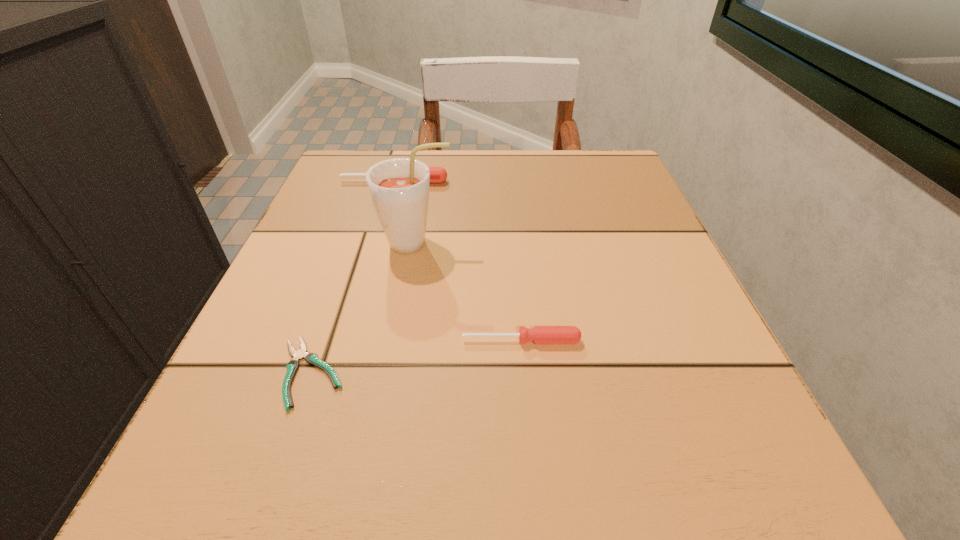
In order to click on free space between the shortest object and the second farthest object in this screenshot , I will do `click(364, 308)`.

The height and width of the screenshot is (540, 960). I want to click on free space between the shortest object and the tallest object, so click(364, 308).

This screenshot has width=960, height=540. In order to click on object that is the third closest one to the third shortest object in this screenshot , I will do `click(311, 358)`.

Image resolution: width=960 pixels, height=540 pixels. I want to click on object identified as the third closest to the shortest object, so click(437, 174).

This screenshot has height=540, width=960. What are the coordinates of `vacant point that satisfies the following two spatial constraints: 1. on the drink side of the root beer; 2. on the left side of the third tallest object` in the screenshot? It's located at (399, 340).

At what (x,y) coordinates should I click in order to perform the action: click on free location that satisfies the following two spatial constraints: 1. on the drink side of the second farthest object; 2. on the back side of the right screwdriver. Please return your answer as a coordinate pair (x, y). This screenshot has height=540, width=960. Looking at the image, I should click on (399, 340).

Image resolution: width=960 pixels, height=540 pixels. In order to click on vacant space that satisfies the following two spatial constraints: 1. on the back side of the shortest object; 2. on the left side of the third shortest object in this screenshot , I will do `click(376, 181)`.

In order to click on free space that satisfies the following two spatial constraints: 1. on the drink side of the tallest object; 2. on the back side of the shorter screwdriver in this screenshot , I will do `click(399, 340)`.